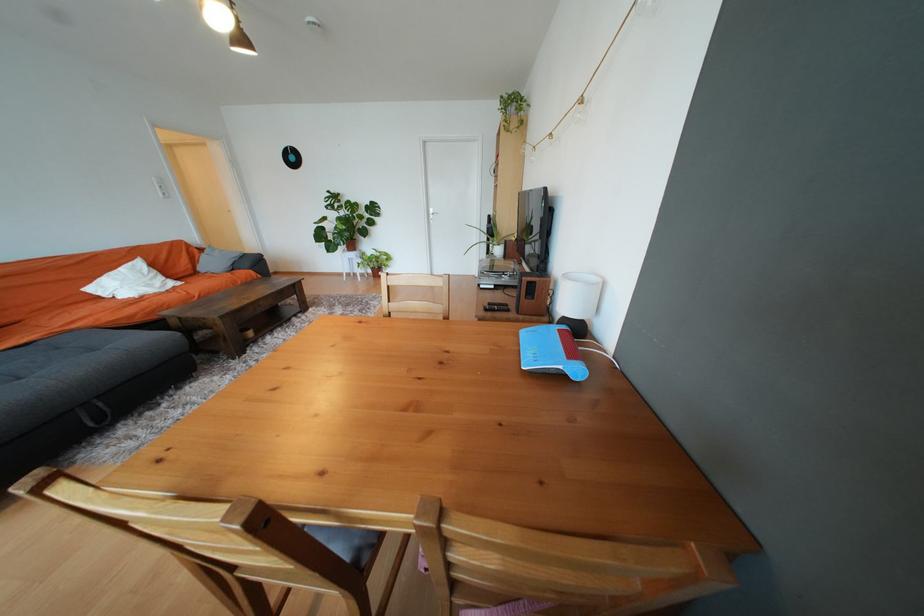
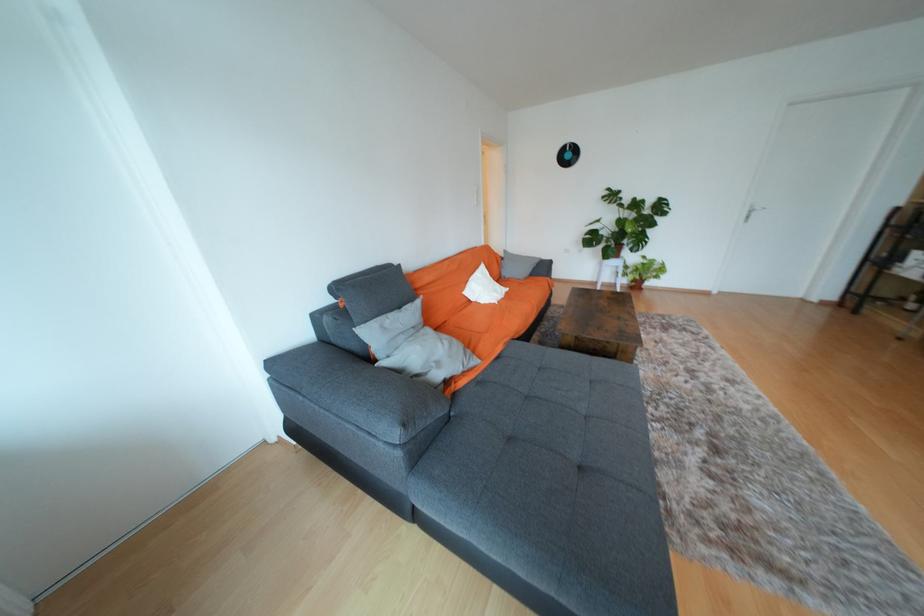
In the second image, find the point that corresponds to [383,275] in the first image.

(641, 286)